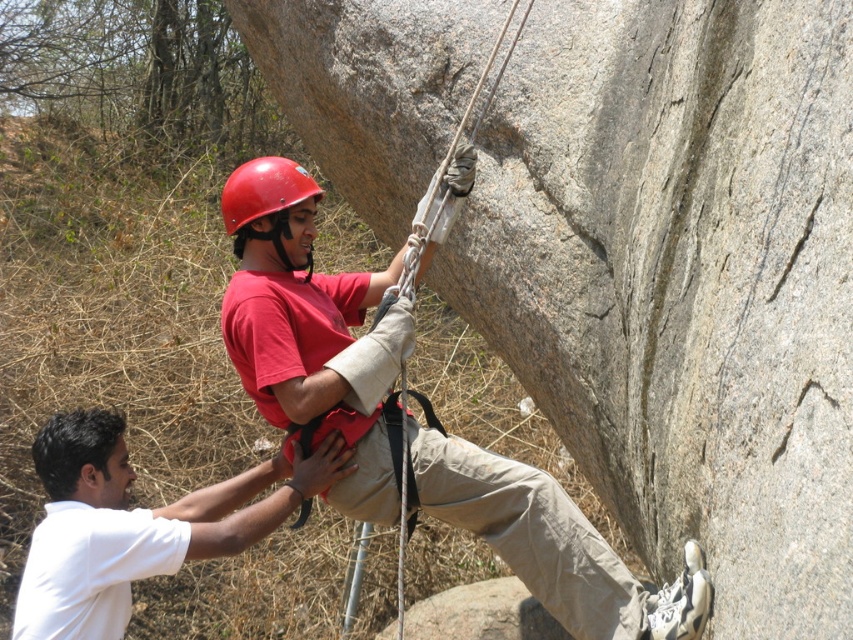
You are a photographer at the base of the rock face. You want to capture both the matte red helmet at upper center and the matte red helmet at center in a single shot. Which helmet will appear bigger in the photo?

The matte red helmet at upper center will appear bigger in the photo because it is larger in size than the matte red helmet at center.

You are a photographer planning to take a wide shot of the rock climbing scene. You want to ensure both the white matte shirt at lower left and the matte red helmet at center are clearly visible. Which object should you adjust your focus on to ensure both are in frame?

The white matte shirt at lower left has a larger width than the matte red helmet at center, so focusing on the larger white matte shirt at lower left will help ensure both objects remain in frame.